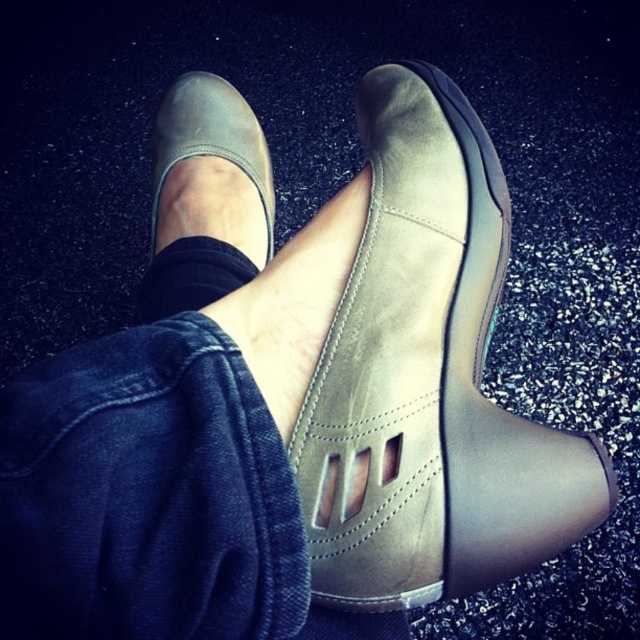
Question: Can you confirm if matte leather shoe at center is bigger than black suede ankle at center?

Choices:
 (A) no
 (B) yes

Answer: (B)

Question: Which point is farther to the camera?

Choices:
 (A) (273, 216)
 (B) (433, 74)

Answer: (A)

Question: Can you confirm if suede tan sandal at center is bigger than black suede ankle at center?

Choices:
 (A) yes
 (B) no

Answer: (A)

Question: Which of the following is the closest to the observer?

Choices:
 (A) suede tan sandal at center
 (B) black suede ankle at center
 (C) matte leather shoe at center

Answer: (A)

Question: Observing the image, what is the correct spatial positioning of suede tan sandal at center in reference to matte leather shoe at center?

Choices:
 (A) below
 (B) above

Answer: (A)

Question: Among these points, which one is nearest to the camera?

Choices:
 (A) pos(448,140)
 (B) pos(208,129)
 (C) pos(205,241)

Answer: (A)